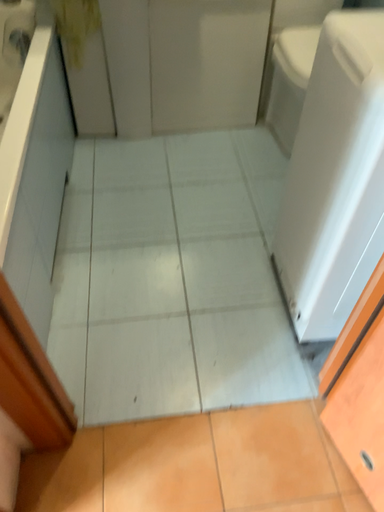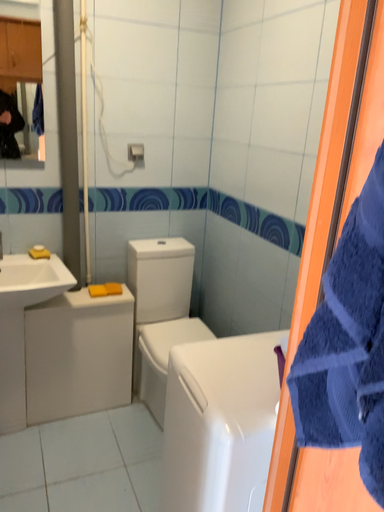
Question: How did the camera likely rotate when shooting the video?

Choices:
 (A) rotated downward
 (B) rotated upward

Answer: (B)